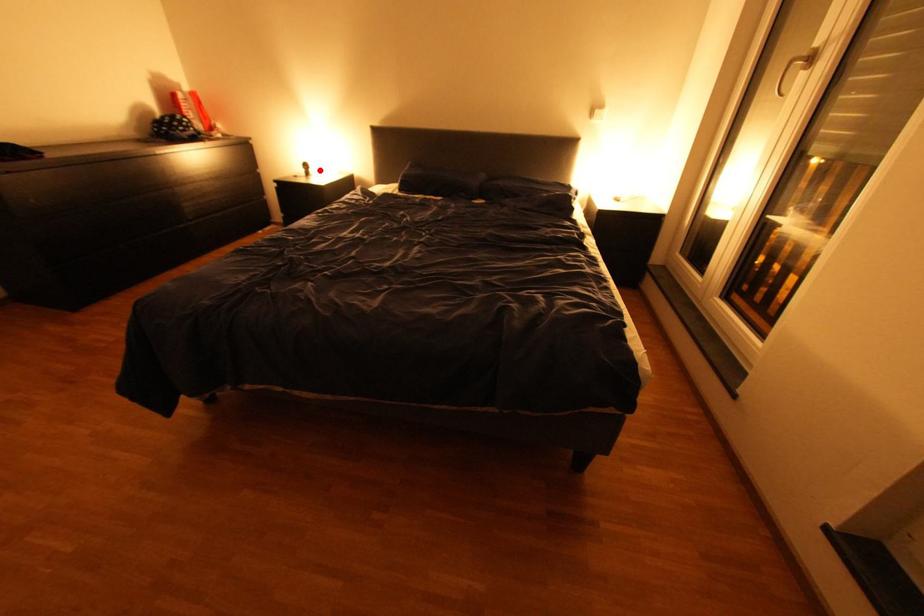
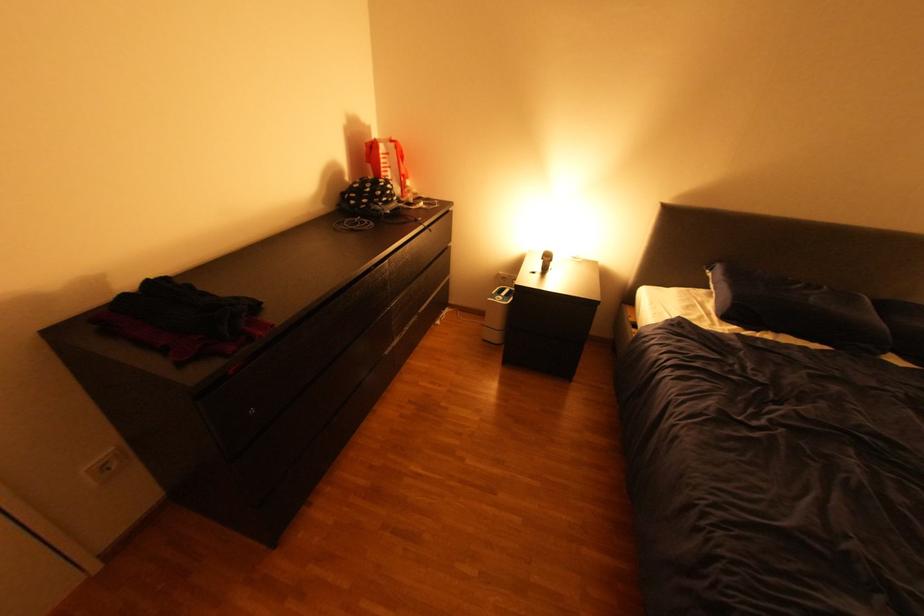
In the second image, find the point that corresponds to the highlighted location in the first image.

(561, 262)